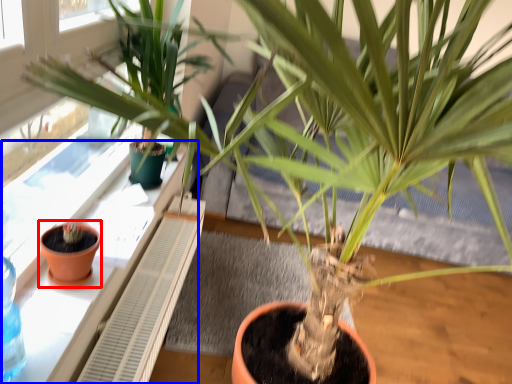
Question: Which point is further to the camera, flowerpot (highlighted by a red box) or window sill (highlighted by a blue box)?

Choices:
 (A) flowerpot
 (B) window sill

Answer: (A)